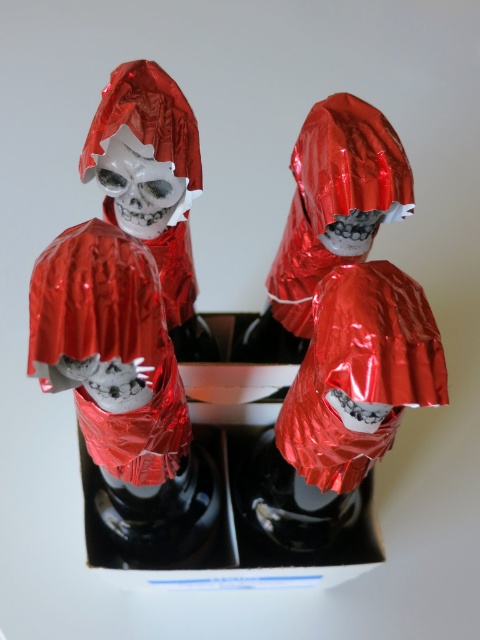
You are an art curator planning to display the two skeletal figurines in a museum. You need to place a metallic black box at center between them. According to the coordinates provided, where exactly should you position the box to ensure it is centered between the two figurines?

The metallic black box at center should be placed at coordinates point [228,506] to be centered between the two skeletal figurines.

Looking at this image, you are an art installer who needs to place a 15 cm wide decorative item on a shelf. The shelf has a maximum weight capacity of 2 kilograms. You have two objects in front of you, the metallic black box at center and the shiny metallic skull at center. Which object can you safely place on the shelf without exceeding the weight limit?

The shiny metallic skull at center is smaller than the metallic black box at center, so it is likely lighter. Therefore, the shiny metallic skull at center can be safely placed on the shelf without exceeding the weight limit.

You are an art curator arranging an exhibition. You have a metallic black box at center and a shiny metallic skull at center. Which object has a greater width? Please base your answer on their spatial relationship in the image.

The metallic black box at center has a greater width than the shiny metallic skull at center, as its width surpasses that of the skull.